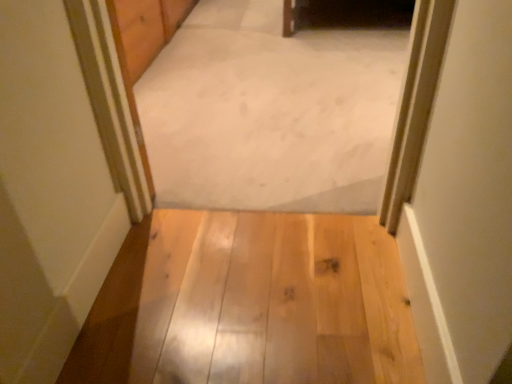
Question: Is light wood floor at center oriented away from white carpet at center?

Choices:
 (A) no
 (B) yes

Answer: (A)

Question: Can you confirm if light wood floor at center is wider than white carpet at center?

Choices:
 (A) yes
 (B) no

Answer: (B)

Question: Is the position of light wood floor at center more distant than that of white carpet at center?

Choices:
 (A) yes
 (B) no

Answer: (B)

Question: From a real-world perspective, is light wood floor at center located beneath white carpet at center?

Choices:
 (A) yes
 (B) no

Answer: (B)

Question: Does light wood floor at center have a greater height compared to white carpet at center?

Choices:
 (A) no
 (B) yes

Answer: (A)

Question: From the image's perspective, is light wood floor at center located above white carpet at center?

Choices:
 (A) yes
 (B) no

Answer: (B)

Question: Is white carpet at center wider than light wood floor at center?

Choices:
 (A) no
 (B) yes

Answer: (B)

Question: Is white carpet at center smaller than light wood floor at center?

Choices:
 (A) yes
 (B) no

Answer: (B)

Question: Can we say white carpet at center lies outside light wood floor at center?

Choices:
 (A) no
 (B) yes

Answer: (B)

Question: From the image's perspective, is white carpet at center on light wood floor at center?

Choices:
 (A) no
 (B) yes

Answer: (B)

Question: Is white carpet at center facing away from light wood floor at center?

Choices:
 (A) no
 (B) yes

Answer: (A)

Question: Is white carpet at center shorter than light wood floor at center?

Choices:
 (A) no
 (B) yes

Answer: (A)

Question: Is light wood floor at center taller or shorter than white carpet at center?

Choices:
 (A) tall
 (B) short

Answer: (B)